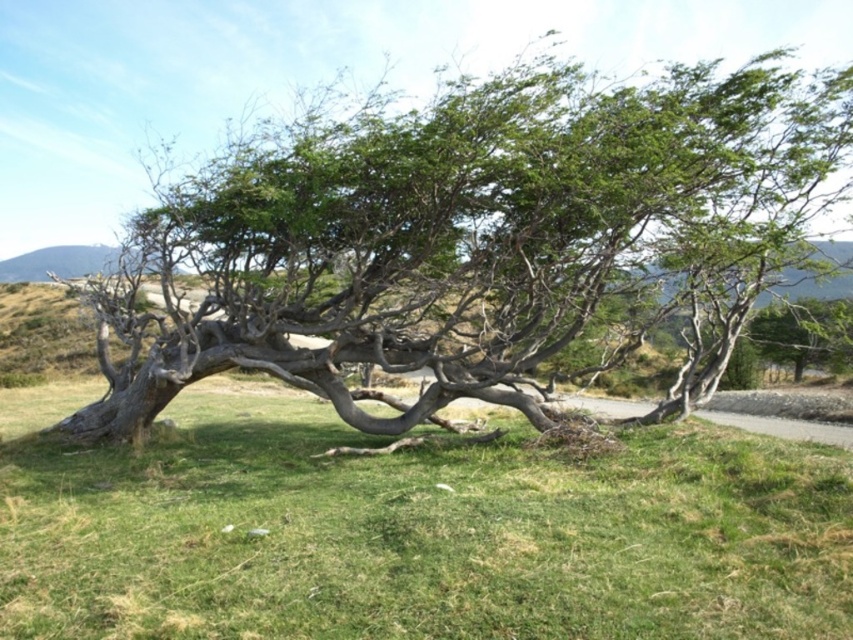
In the scene shown: Can you confirm if green rough bark tree at center is wider than green grass at center?

No, green rough bark tree at center is not wider than green grass at center.

Can you confirm if green rough bark tree at center is taller than green grass at center?

In fact, green rough bark tree at center may be shorter than green grass at center.

Which is in front, point (457, 320) or point (663, 584)?

Point (663, 584) is in front.

You are a GUI agent. You are given a task and a screenshot of the screen. Output one action in this format:
    pyautogui.click(x=<x>, y=<y>)
    Task: Click on the green rough bark tree at center
    Image resolution: width=853 pixels, height=640 pixels.
    Given the screenshot: What is the action you would take?
    pos(471,236)

Can you confirm if green grass at center is positioned below green leafy tree at center?

Yes.

Between green grass at center and green leafy tree at center, which one appears on the left side from the viewer's perspective?

From the viewer's perspective, green grass at center appears more on the left side.

Is point (252, 429) behind point (833, 362)?

No.

Where is `green grass at center`? green grass at center is located at coordinates (412, 531).

Who is positioned more to the left, green rough bark tree at center or green leafy tree at center?

Positioned to the left is green rough bark tree at center.

Can you confirm if green rough bark tree at center is bigger than green leafy tree at center?

Incorrect, green rough bark tree at center is not larger than green leafy tree at center.

Locate an element on the screen. The width and height of the screenshot is (853, 640). green rough bark tree at center is located at coordinates (471, 236).